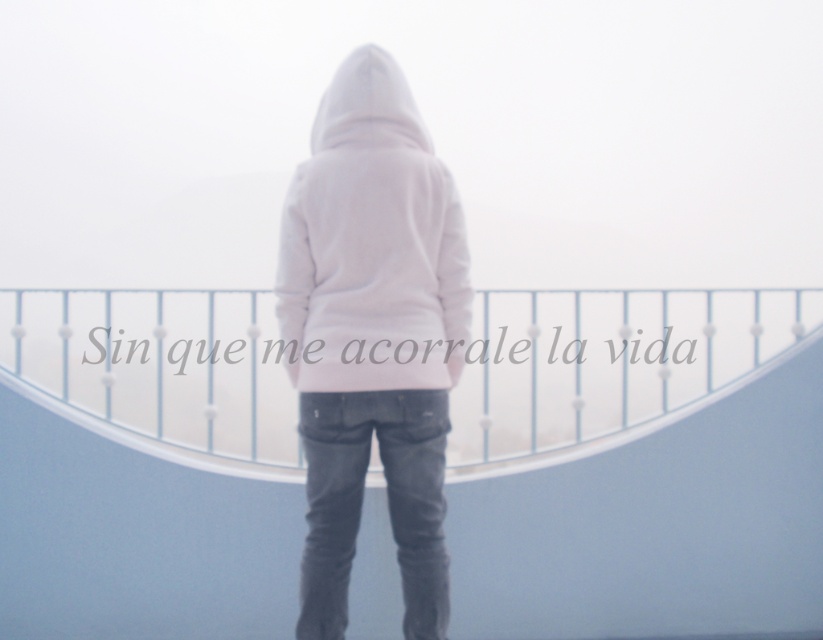
Question: Can you confirm if white plastic railing at center is positioned below white fleece hoodie at center?

Choices:
 (A) no
 (B) yes

Answer: (B)

Question: Which point appears closest to the camera in this image?

Choices:
 (A) (430, 172)
 (B) (349, 125)

Answer: (A)

Question: Does white fleece hoodie at center have a lesser width compared to white matte hoodie at center?

Choices:
 (A) no
 (B) yes

Answer: (A)

Question: Which of the following is the closest to the observer?

Choices:
 (A) white matte hoodie at center
 (B) white plastic railing at center
 (C) white fleece hoodie at center

Answer: (C)

Question: Does white plastic railing at center appear on the right side of white matte hoodie at center?

Choices:
 (A) yes
 (B) no

Answer: (A)

Question: Which of the following is the farthest from the observer?

Choices:
 (A) white plastic railing at center
 (B) white fleece hoodie at center
 (C) white matte hoodie at center

Answer: (A)